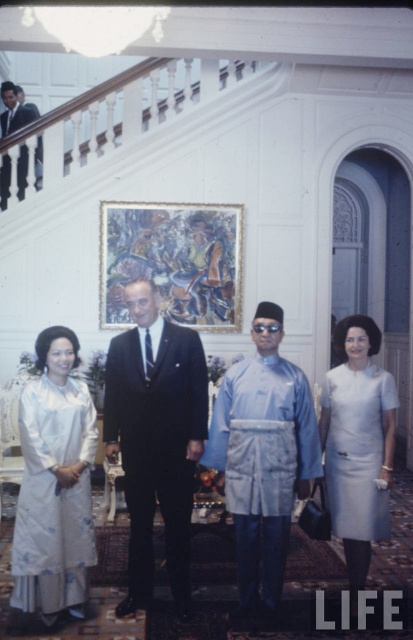
Question: Which point is closer to the camera taking this photo?

Choices:
 (A) (63, 412)
 (B) (154, 296)
 (C) (4, 92)

Answer: (A)

Question: Is silky white dress at lower left to the right of white satin dress at right from the viewer's perspective?

Choices:
 (A) no
 (B) yes

Answer: (A)

Question: Is dark suit at center closer to the viewer compared to light blue silk robe at center?

Choices:
 (A) no
 (B) yes

Answer: (A)

Question: Does light blue silk robe at center appear on the right side of silky white dress at lower left?

Choices:
 (A) yes
 (B) no

Answer: (A)

Question: Considering the real-world distances, which object is farthest from the dark suit at upper left?

Choices:
 (A) light blue silk robe at center
 (B) dark suit at center
 (C) silky white dress at lower left
 (D) white satin dress at right

Answer: (D)

Question: Which point is farther to the camera?

Choices:
 (A) silky white dress at lower left
 (B) dark suit at upper left

Answer: (B)